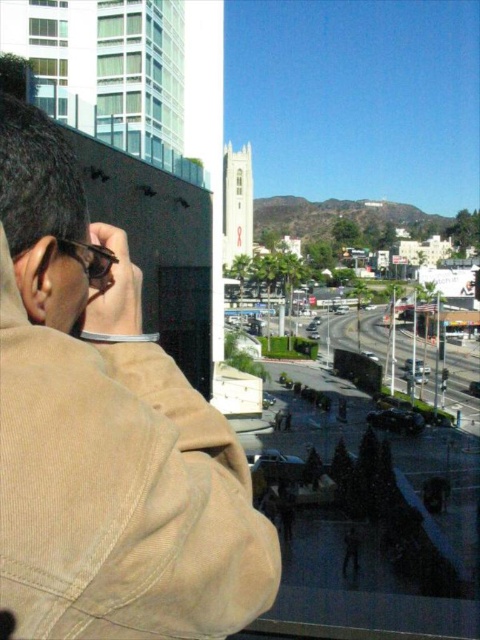
You are a delivery drone that needs to fly from the tan corduroy trench coat at upper left to the clear glass window at upper left. Given that your maximum flight distance is 200 feet, can you make the trip without recharging?

The distance between the tan corduroy trench coat at upper left and the clear glass window at upper left is 194.58 feet, which is under your 200 feet maximum flight distance. Yes, you can make the trip without recharging.

You are a photographer trying to capture the city view through the green glass window at upper left. However, there is a tan corduroy trench coat at upper left blocking your view. Can you still see the city through the window?

The tan corduroy trench coat at upper left is larger in size than the green glass window at upper left, so it is blocking the entire window. Therefore, you cannot see the city through the green glass window at upper left.